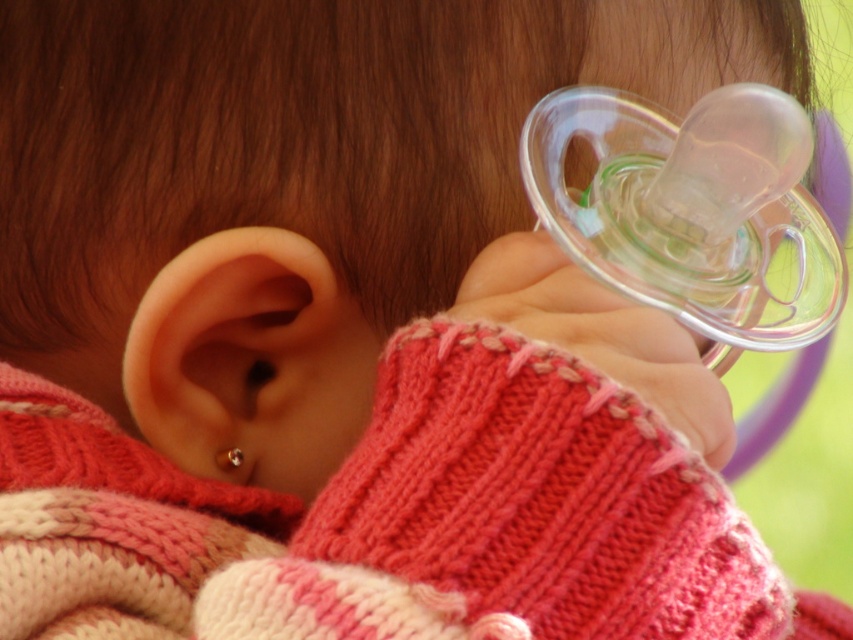
Which is behind, point (144, 340) or point (229, 458)?

The point (229, 458) is more distant.

Which of these two, pearl earring at lower left or clear plastic teething ring at ear, stands taller?

pearl earring at lower left

Looking at this image, who is more forward, (148,353) or (225,461)?

Point (148,353) is more forward.

Identify the location of pearl earring at lower left. This screenshot has height=640, width=853. (244, 358).